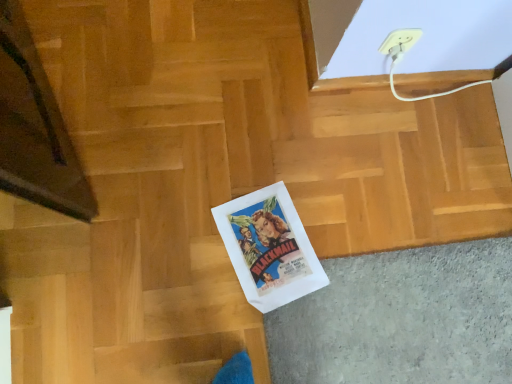
Question: Considering the relative sizes of white paper bag at center and white plastic electric outlet at upper right in the image provided, is white paper bag at center taller than white plastic electric outlet at upper right?

Choices:
 (A) yes
 (B) no

Answer: (B)

Question: Does white paper bag at center have a smaller size compared to white plastic electric outlet at upper right?

Choices:
 (A) yes
 (B) no

Answer: (B)

Question: Considering the relative positions of white paper bag at center and white plastic electric outlet at upper right in the image provided, is white paper bag at center to the left of white plastic electric outlet at upper right from the viewer's perspective?

Choices:
 (A) no
 (B) yes

Answer: (B)

Question: Considering the relative sizes of white paper bag at center and white plastic electric outlet at upper right in the image provided, is white paper bag at center bigger than white plastic electric outlet at upper right?

Choices:
 (A) no
 (B) yes

Answer: (B)

Question: Could you tell me if white paper bag at center is facing white plastic electric outlet at upper right?

Choices:
 (A) yes
 (B) no

Answer: (B)

Question: Is white paper bag at center completely or partially outside of white plastic electric outlet at upper right?

Choices:
 (A) yes
 (B) no

Answer: (A)

Question: Considering the relative sizes of white plastic electric outlet at upper right and white paper bag at center in the image provided, is white plastic electric outlet at upper right wider than white paper bag at center?

Choices:
 (A) no
 (B) yes

Answer: (A)

Question: Is white plastic electric outlet at upper right far away from white paper bag at center?

Choices:
 (A) yes
 (B) no

Answer: (B)

Question: Is white plastic electric outlet at upper right placed right next to white paper bag at center?

Choices:
 (A) yes
 (B) no

Answer: (B)

Question: Is white plastic electric outlet at upper right facing away from white paper bag at center?

Choices:
 (A) no
 (B) yes

Answer: (A)

Question: Is white plastic electric outlet at upper right outside of white paper bag at center?

Choices:
 (A) yes
 (B) no

Answer: (A)

Question: Considering the relative sizes of white plastic electric outlet at upper right and white paper bag at center in the image provided, is white plastic electric outlet at upper right shorter than white paper bag at center?

Choices:
 (A) no
 (B) yes

Answer: (A)

Question: From a real-world perspective, is white paper bag at center above or below white plastic electric outlet at upper right?

Choices:
 (A) below
 (B) above

Answer: (A)